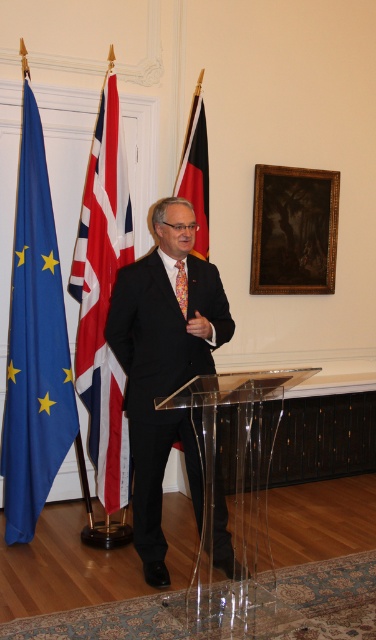
Question: Does transparent acrylic podium at center have a greater width compared to black matte flag at center?

Choices:
 (A) no
 (B) yes

Answer: (B)

Question: Among these objects, which one is farthest from the camera?

Choices:
 (A) black matte flag at center
 (B) transparent acrylic podium at center

Answer: (A)

Question: Is blue fabric flag at left wider than floral silk tie at center?

Choices:
 (A) no
 (B) yes

Answer: (B)

Question: Which object is positioned closest to the floral silk tie at center?

Choices:
 (A) black matte flag at center
 (B) blue fabric flag at left
 (C) red and white striped flag at left

Answer: (C)

Question: Estimate the real-world distances between objects in this image. Which object is farther from the black matte flag at center?

Choices:
 (A) floral silk tie at center
 (B) blue fabric flag at left

Answer: (B)

Question: Can you confirm if red and white striped flag at left is positioned above black matte flag at center?

Choices:
 (A) yes
 (B) no

Answer: (B)